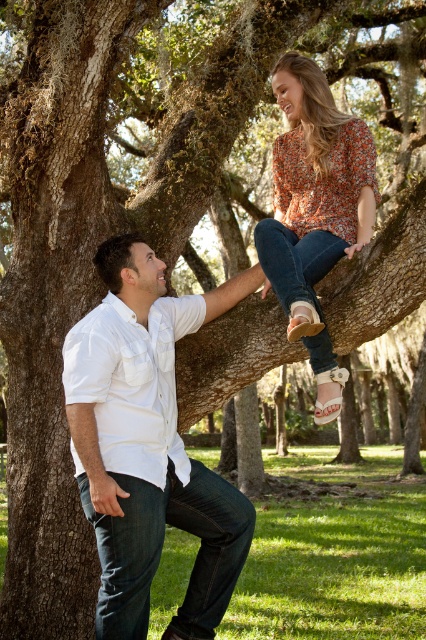
Is white cotton shirt at left shorter than floral print blouse at upper center?

No, white cotton shirt at left is not shorter than floral print blouse at upper center.

Is white cotton shirt at left below floral print blouse at upper center?

Indeed, white cotton shirt at left is positioned under floral print blouse at upper center.

I want to click on white cotton shirt at left, so click(x=147, y=445).